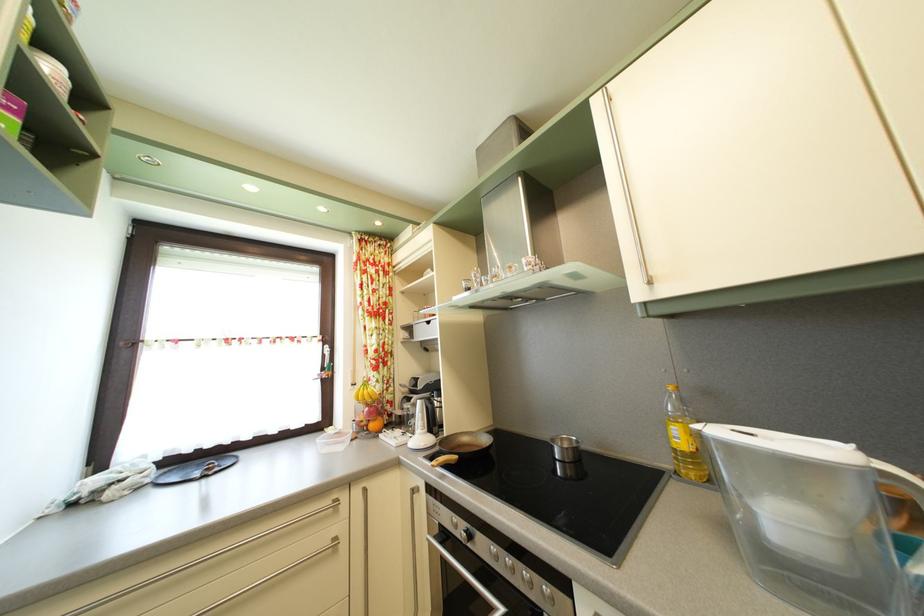
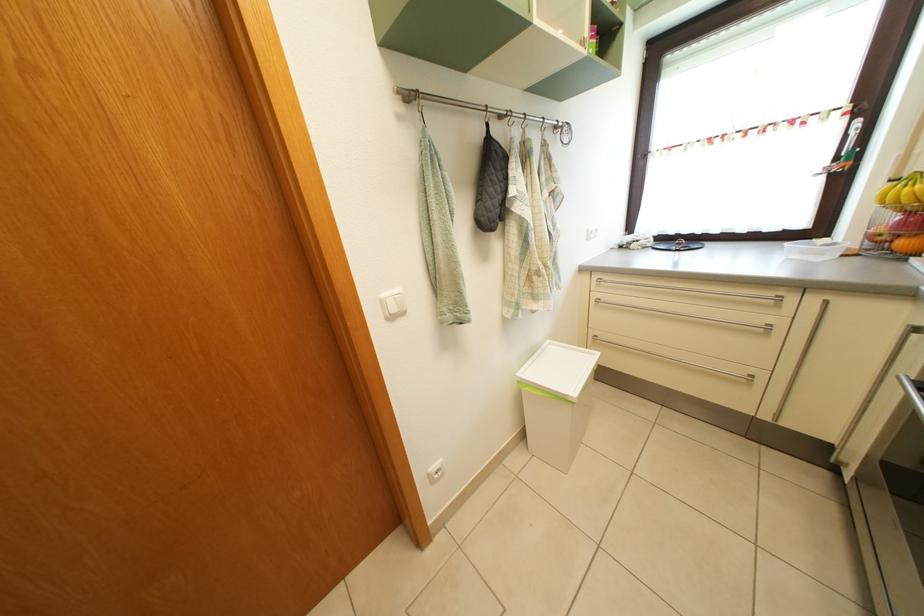
Find the pixel in the second image that matches pixel 381 432 in the first image.

(910, 252)